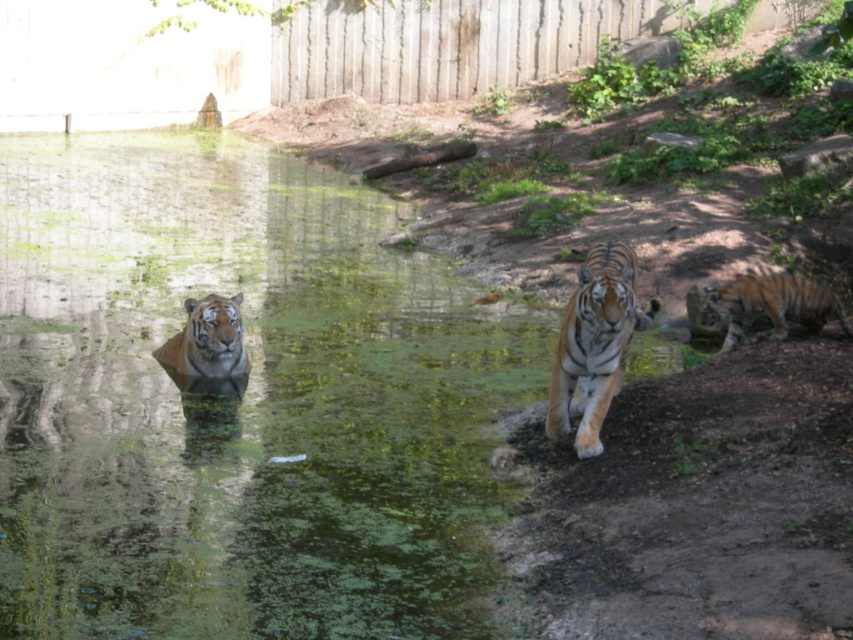
Question: Which point is farther to the camera?

Choices:
 (A) orange striped tiger at left
 (B) orange striped tiger at right
 (C) orange striped tiger at center

Answer: (B)

Question: Considering the real-world distances, which object is farthest from the orange striped tiger at center?

Choices:
 (A) orange striped tiger at left
 (B) orange striped tiger at right

Answer: (A)

Question: Does orange striped tiger at center have a smaller size compared to orange striped tiger at right?

Choices:
 (A) yes
 (B) no

Answer: (A)

Question: Does orange striped tiger at center appear on the right side of orange striped tiger at left?

Choices:
 (A) no
 (B) yes

Answer: (B)

Question: In this image, where is orange striped tiger at center located relative to orange striped tiger at right?

Choices:
 (A) below
 (B) above

Answer: (A)

Question: Which object appears farthest from the camera in this image?

Choices:
 (A) orange striped tiger at left
 (B) orange striped tiger at center
 (C) orange striped tiger at right

Answer: (C)